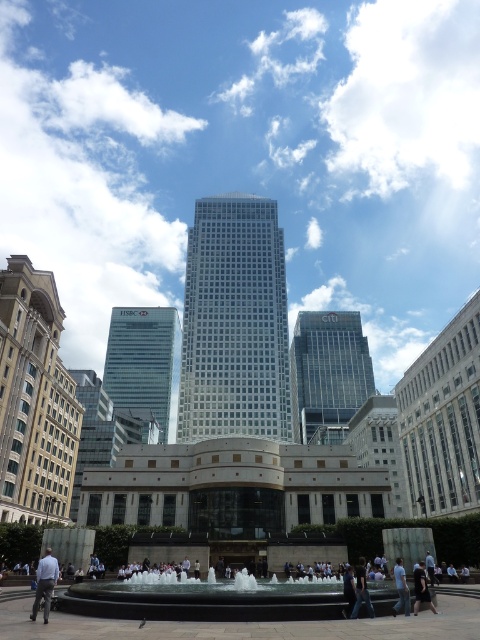
Between white glass skyscraper at center and glassy reflective skyscraper at left, which one is positioned lower?

glassy reflective skyscraper at left is below.

Can you confirm if white glass skyscraper at center is positioned to the left of glassy reflective skyscraper at left?

In fact, white glass skyscraper at center is to the right of glassy reflective skyscraper at left.

Between point (188, 429) and point (75, 500), which one is positioned behind?

Positioned behind is point (188, 429).

Identify the location of white glass skyscraper at center. (235, 321).

Can you confirm if beige stone building at left is bigger than reflective glass fountain at center?

Correct, beige stone building at left is larger in size than reflective glass fountain at center.

Is beige stone building at left thinner than reflective glass fountain at center?

Yes.

This screenshot has width=480, height=640. I want to click on beige stone building at left, so click(34, 397).

Can you confirm if glassy reflective skyscraper at center is smaller than black fabric person at lower right?

No, glassy reflective skyscraper at center is not smaller than black fabric person at lower right.

Does glassy reflective skyscraper at center lie behind black fabric person at lower right?

Yes, it is behind black fabric person at lower right.

Between point (340, 323) and point (430, 605), which one is positioned behind?

Point (340, 323)

At what (x,y) coordinates should I click in order to perform the action: click on glassy reflective skyscraper at center. Please return your answer as a coordinate pair (x, y). The width and height of the screenshot is (480, 640). Looking at the image, I should click on (327, 369).